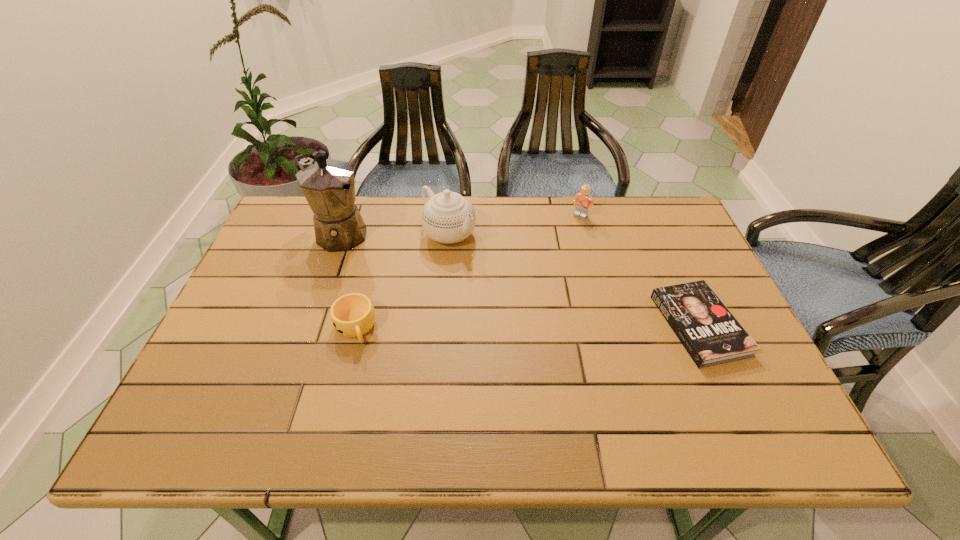
Identify the location of the second shortest object. (352, 315).

Where is `book`? book is located at coordinates (709, 332).

Locate an element on the screen. The height and width of the screenshot is (540, 960). the rightmost object is located at coordinates (709, 332).

This screenshot has height=540, width=960. I want to click on the second tallest object, so click(x=447, y=217).

Where is `chinaware`? The height and width of the screenshot is (540, 960). chinaware is located at coordinates (447, 217).

The width and height of the screenshot is (960, 540). In order to click on the third shortest object in this screenshot , I will do `click(583, 199)`.

Locate an element on the screen. This screenshot has width=960, height=540. Lego is located at coordinates (583, 199).

The image size is (960, 540). I want to click on the tallest object, so click(x=328, y=185).

You are a GUI agent. You are given a task and a screenshot of the screen. Output one action in this format:
    pyautogui.click(x=<x>, y=<y>)
    Task: Click on the free space located on the left of the second shortest object
    This screenshot has height=540, width=960.
    Given the screenshot: What is the action you would take?
    [x=273, y=328]

The image size is (960, 540). In order to click on free location located 0.080m on the front of the rightmost object in this screenshot , I will do `click(733, 401)`.